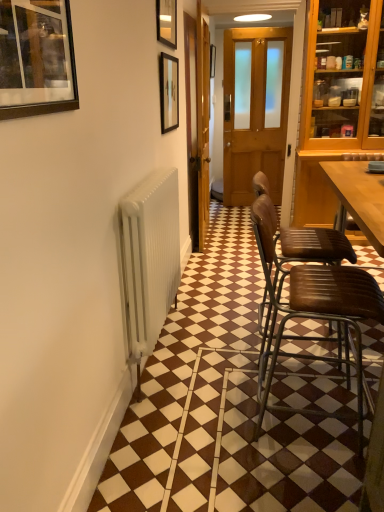
Question: Is brown leather chair at right, marked as the 1th chair in a front-to-back arrangement, in front of or behind wooden picture frame at center, which ranks as the first picture frame in right-to-left order, in the image?

Choices:
 (A) behind
 (B) front

Answer: (B)

Question: From a real-world perspective, relative to wooden picture frame at center, which ranks as the first picture frame in right-to-left order, is brown leather chair at right, marked as the 1th chair in a front-to-back arrangement, vertically above or below?

Choices:
 (A) above
 (B) below

Answer: (B)

Question: Estimate the real-world distances between objects in this image. Which object is closer to the matte black picture frame at upper center, which appears as the 3th picture frame when viewed from the back?

Choices:
 (A) wooden door at center
 (B) matte black picture frame at upper left, the 1th picture frame positioned from the bottom
 (C) matte black picture frame at upper center, positioned as the 2th picture frame in back-to-front order
 (D) wooden screen door at center
 (E) brown leather chair at right, which appears as the 2th chair when viewed from the back

Answer: (C)

Question: Which of these objects is positioned farthest from the wooden picture frame at center, acting as the 4th picture frame starting from the front?

Choices:
 (A) matte black picture frame at upper left, which is counted as the fourth picture frame, starting from the right
 (B) brown leather chair at right, marked as the 1th chair in a front-to-back arrangement
 (C) brown leather chair at right, the 2th chair viewed from the front
 (D) matte black picture frame at upper center, placed as the third picture frame when sorted from bottom to top
 (E) wooden screen door at center

Answer: (A)